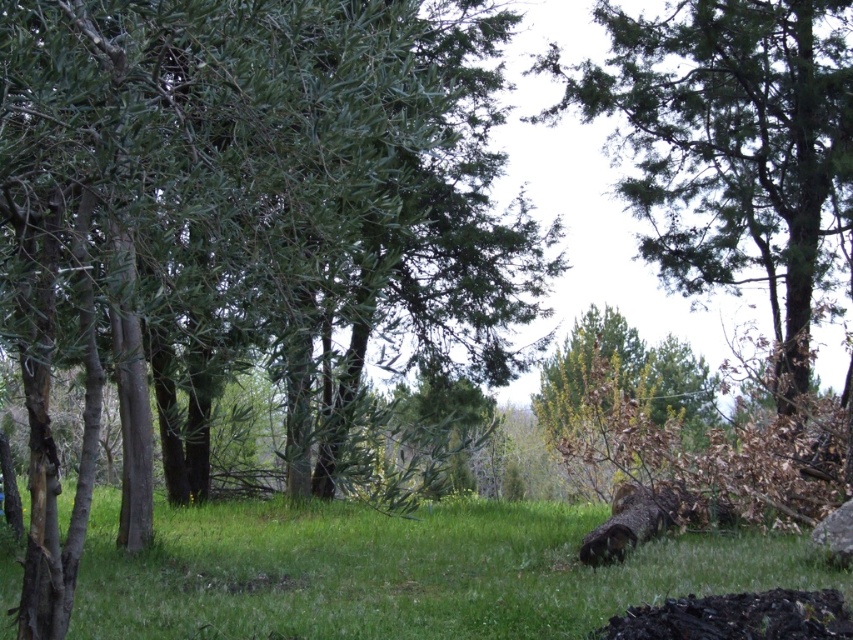
Which is below, green grassy at lower center or green leafy tree at upper right?

green grassy at lower center is below.

Who is higher up, green grassy at lower center or green leafy tree at upper right?

green leafy tree at upper right is above.

Does point (375, 616) lie in front of point (769, 35)?

Yes, it is.

Identify the location of green grassy at lower center. (401, 572).

Based on the photo, is green leafy tree at center taller than green grassy at lower center?

Correct, green leafy tree at center is much taller as green grassy at lower center.

Can you confirm if green leafy tree at center is positioned below green grassy at lower center?

Incorrect, green leafy tree at center is not positioned below green grassy at lower center.

Who is more forward, (192, 122) or (809, 563)?

Point (192, 122)

Where is `green leafy tree at center`? The image size is (853, 640). green leafy tree at center is located at coordinates (248, 221).

Does green leafy tree at center have a smaller size compared to green leafy tree at upper right?

Actually, green leafy tree at center might be larger than green leafy tree at upper right.

Who is more distant from viewer, (387, 26) or (670, 170)?

The point (670, 170) is behind.

Find the location of a particular element. green leafy tree at center is located at coordinates (248, 221).